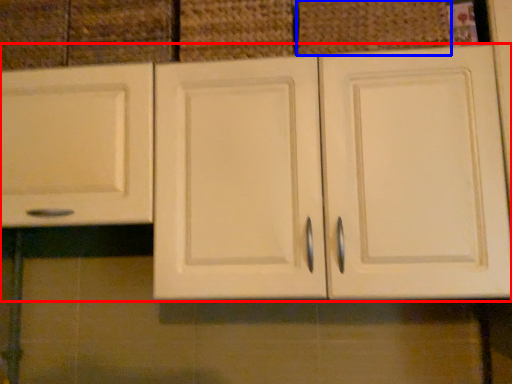
Question: Among these objects, which one is farthest to the camera, cabinetry (highlighted by a red box) or basket (highlighted by a blue box)?

Choices:
 (A) cabinetry
 (B) basket

Answer: (B)